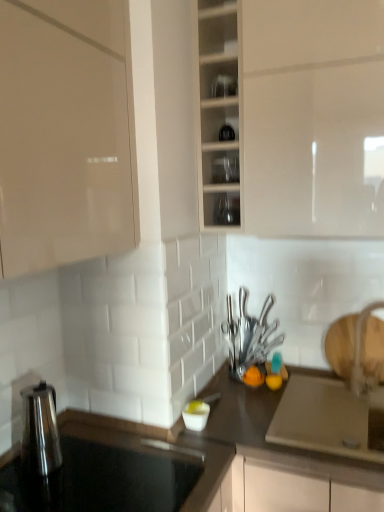
At what (x,y) coordinates should I click in order to perform the action: click on vacant area that lies in front of white glossy faucet at right. Please return your answer as a coordinate pair (x, y). Looking at the image, I should click on (365, 413).